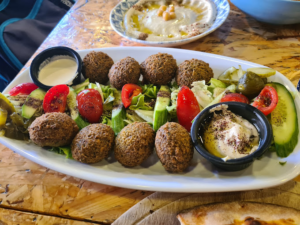
You are a GUI agent. You are given a task and a screenshot of the screen. Output one action in this format:
    pyautogui.click(x=<x>, y=<y>)
    Task: Click on the bowl
    
    Given the screenshot: What is the action you would take?
    pyautogui.click(x=261, y=14)